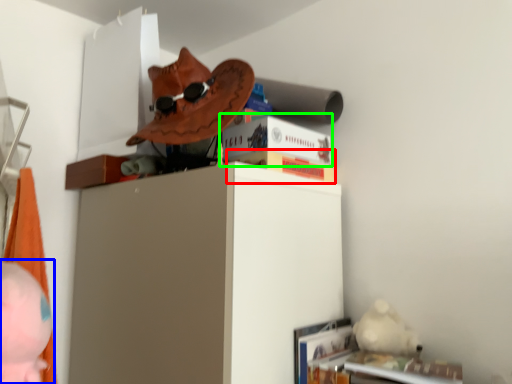
Question: Based on their relative distances, which object is nearer to paperback book (highlighted by a red box)? Choose from person (highlighted by a blue box) and paperback book (highlighted by a green box).

Choices:
 (A) person
 (B) paperback book

Answer: (B)